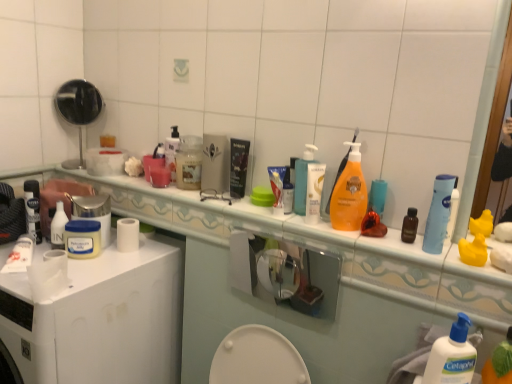
Question: Considering the positions of white pump bottle at center right, the 1th cleaning product viewed from the front, and white glossy counter top at upper center in the image, is white pump bottle at center right, the 1th cleaning product viewed from the front, wider or thinner than white glossy counter top at upper center?

Choices:
 (A) thin
 (B) wide

Answer: (A)

Question: Based on their positions, is white pump bottle at center right, arranged as the 3th cleaning product when viewed from the left, located to the left or right of white glossy counter top at upper center?

Choices:
 (A) right
 (B) left

Answer: (A)

Question: Which is farther from the white matte jar at center-left, which ranks as the third toiletry in right-to-left order?

Choices:
 (A) polished silver mirror at upper left
 (B) translucent plastic pump bottle at center, acting as the second cleaning product starting from the top
 (C) white glossy counter top at upper center
 (D) white plastic jar at upper left, the 1th mouthwash viewed from the left
 (E) matte black tube at center

Answer: (B)

Question: Considering the real-world distances, which object is closest to the white glossy counter top at upper center?

Choices:
 (A) translucent plastic jar at center, marked as the 2th mouthwash in a right-to-left arrangement
 (B) white plastic jar at upper left, the 1th mouthwash viewed from the left
 (C) white plastic container at center
 (D) polished silver mirror at upper left
 (E) blue plastic tube at upper right, marked as the 1th mouthwash in a front-to-back arrangement

Answer: (A)